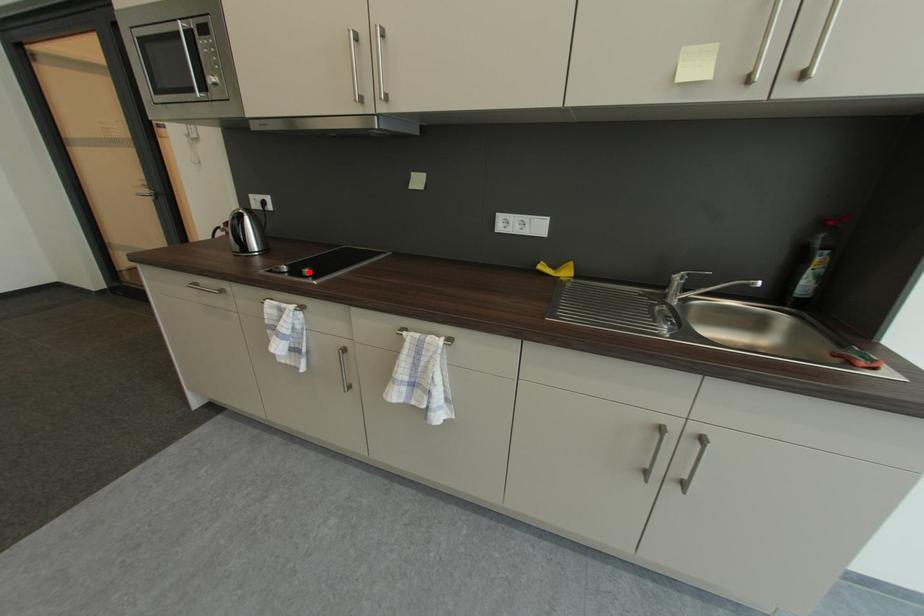
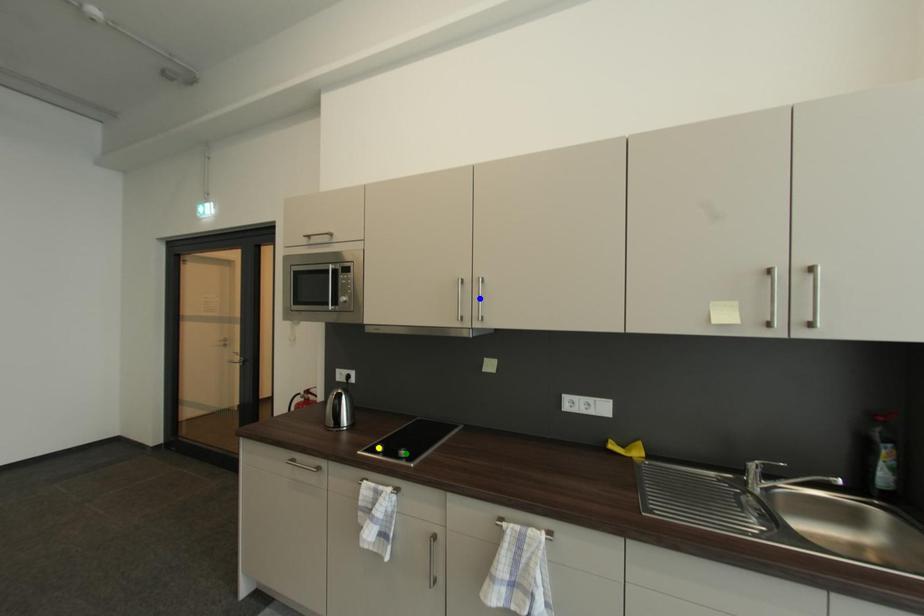
Question: I am providing you with two images of the same scene from different viewpoints. A red point is marked on the first image. You are given multiple points on the second image. Which mark in image 2 goes with the point in image 1?

Choices:
 (A) blue point
 (B) green point
 (C) yellow point

Answer: (B)